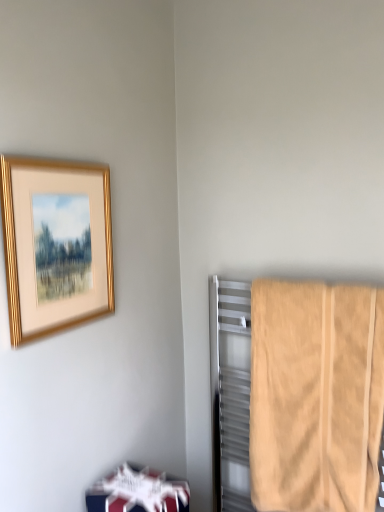
Question: Is white glossy bookshelf at lower left positioned beyond the bounds of gold metallic picture frame at upper left?

Choices:
 (A) no
 (B) yes

Answer: (B)

Question: Does white glossy bookshelf at lower left appear on the left side of gold metallic picture frame at upper left?

Choices:
 (A) no
 (B) yes

Answer: (A)

Question: Considering the relative positions of white glossy bookshelf at lower left and gold metallic picture frame at upper left in the image provided, is white glossy bookshelf at lower left behind gold metallic picture frame at upper left?

Choices:
 (A) no
 (B) yes

Answer: (B)

Question: Does white glossy bookshelf at lower left have a smaller size compared to gold metallic picture frame at upper left?

Choices:
 (A) no
 (B) yes

Answer: (B)

Question: From a real-world perspective, is white glossy bookshelf at lower left over gold metallic picture frame at upper left?

Choices:
 (A) no
 (B) yes

Answer: (A)

Question: Is white glossy bookshelf at lower left next to gold metallic picture frame at upper left?

Choices:
 (A) no
 (B) yes

Answer: (A)

Question: Are white glossy bookshelf at lower left and beige cotton towel at right far apart?

Choices:
 (A) no
 (B) yes

Answer: (A)

Question: Is white glossy bookshelf at lower left positioned beyond the bounds of beige cotton towel at right?

Choices:
 (A) no
 (B) yes

Answer: (B)

Question: Considering the relative sizes of white glossy bookshelf at lower left and beige cotton towel at right in the image provided, is white glossy bookshelf at lower left smaller than beige cotton towel at right?

Choices:
 (A) no
 (B) yes

Answer: (B)

Question: Is white glossy bookshelf at lower left facing towards beige cotton towel at right?

Choices:
 (A) no
 (B) yes

Answer: (A)

Question: Considering the relative positions of white glossy bookshelf at lower left and beige cotton towel at right in the image provided, is white glossy bookshelf at lower left to the right of beige cotton towel at right from the viewer's perspective?

Choices:
 (A) yes
 (B) no

Answer: (B)

Question: Is beige cotton towel at right completely or partially inside white glossy bookshelf at lower left?

Choices:
 (A) no
 (B) yes

Answer: (A)

Question: From a real-world perspective, does beige cotton towel at right stand above white glossy bookshelf at lower left?

Choices:
 (A) no
 (B) yes

Answer: (B)